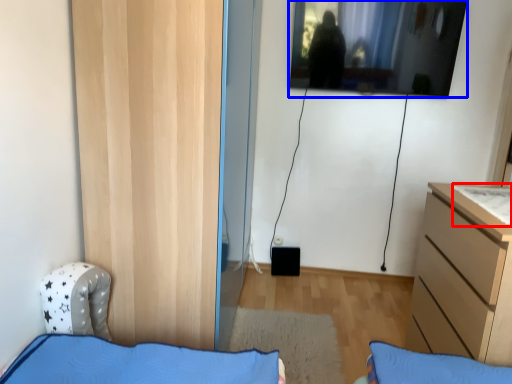
Question: Which object is closer to the camera taking this photo, sheet (highlighted by a red box) or window (highlighted by a blue box)?

Choices:
 (A) sheet
 (B) window

Answer: (A)